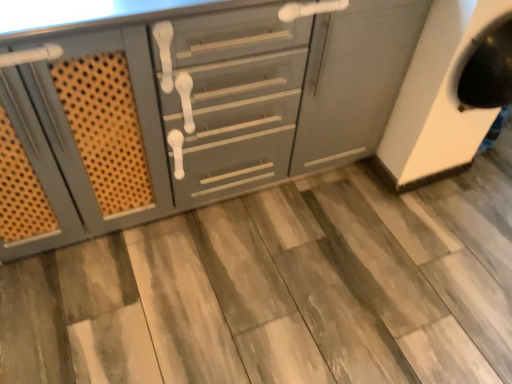
Question: From their relative heights in the image, would you say wooden tile at center is taller or shorter than matte gray cabinet at center?

Choices:
 (A) tall
 (B) short

Answer: (B)

Question: In the image, is wooden tile at center positioned in front of or behind matte gray cabinet at center?

Choices:
 (A) front
 (B) behind

Answer: (B)

Question: Which is correct: wooden tile at center is inside matte gray cabinet at center, or outside of it?

Choices:
 (A) inside
 (B) outside

Answer: (B)

Question: From the image's perspective, is matte gray cabinet at center above or below wooden tile at center?

Choices:
 (A) below
 (B) above

Answer: (B)

Question: In terms of size, does matte gray cabinet at center appear bigger or smaller than wooden tile at center?

Choices:
 (A) small
 (B) big

Answer: (B)

Question: Based on their positions, is matte gray cabinet at center located to the left or right of wooden tile at center?

Choices:
 (A) left
 (B) right

Answer: (A)

Question: Is matte gray cabinet at center in front of or behind wooden tile at center in the image?

Choices:
 (A) behind
 (B) front

Answer: (B)